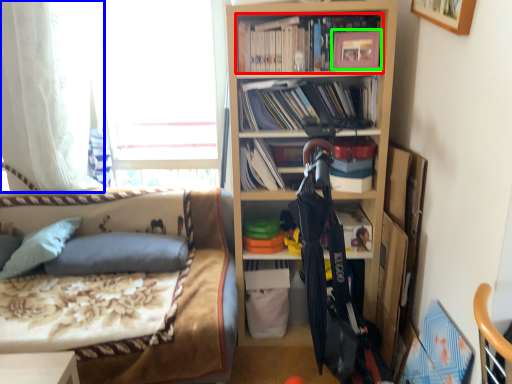
Question: Which object is positioned farthest from book (highlighted by a red box)? Select from curtain (highlighted by a blue box) and picture frame (highlighted by a green box).

Choices:
 (A) curtain
 (B) picture frame

Answer: (A)